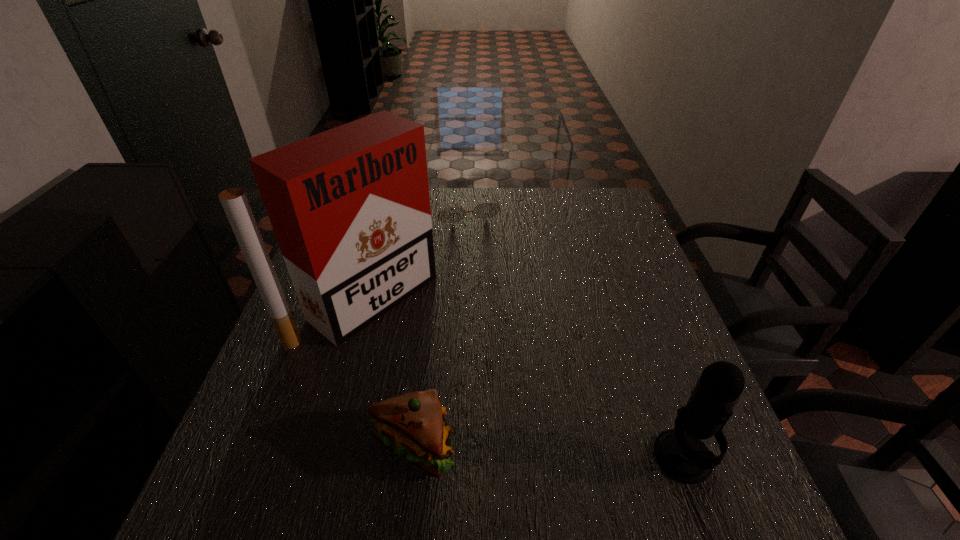
This screenshot has width=960, height=540. Identify the location of free space on the desktop that is between the sandwich and the rightmost object and is positioned on the front-facing side of the third nearest object. (582, 453).

Identify the location of vacant space on the desktop that is between the second shortest object and the second tallest object and is positioned on the face of the sunglasses. (566, 453).